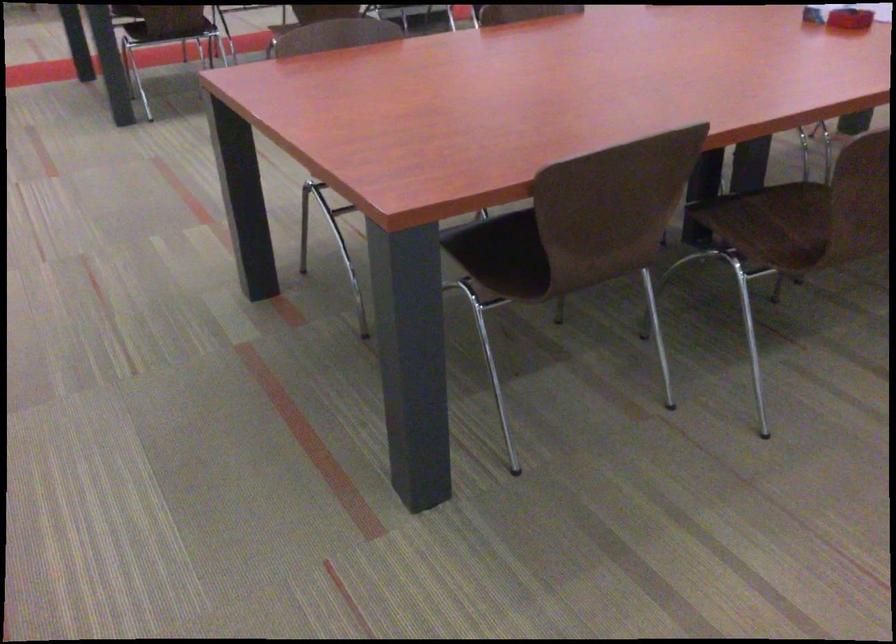
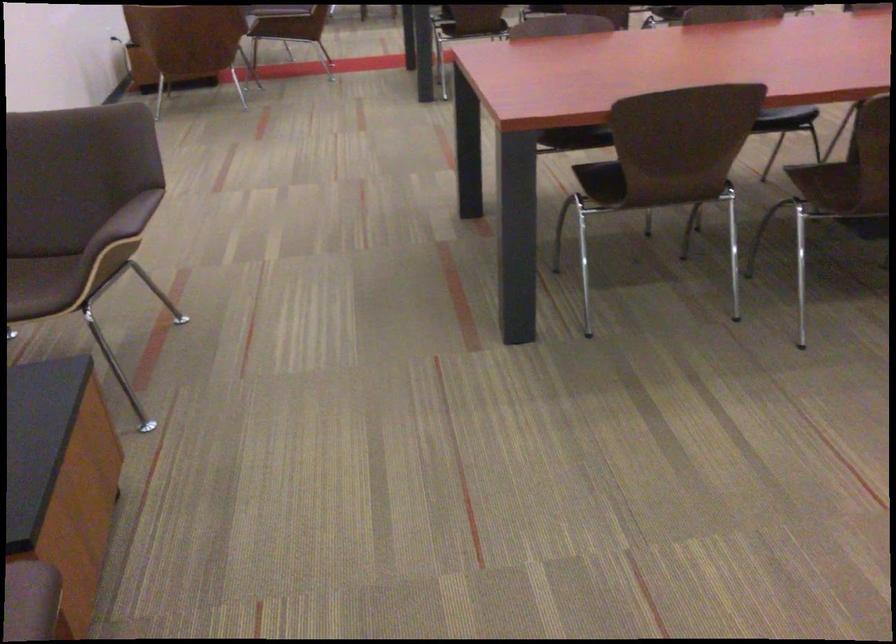
Where in the second image is the point corresponding to (x=737, y=232) from the first image?

(819, 183)